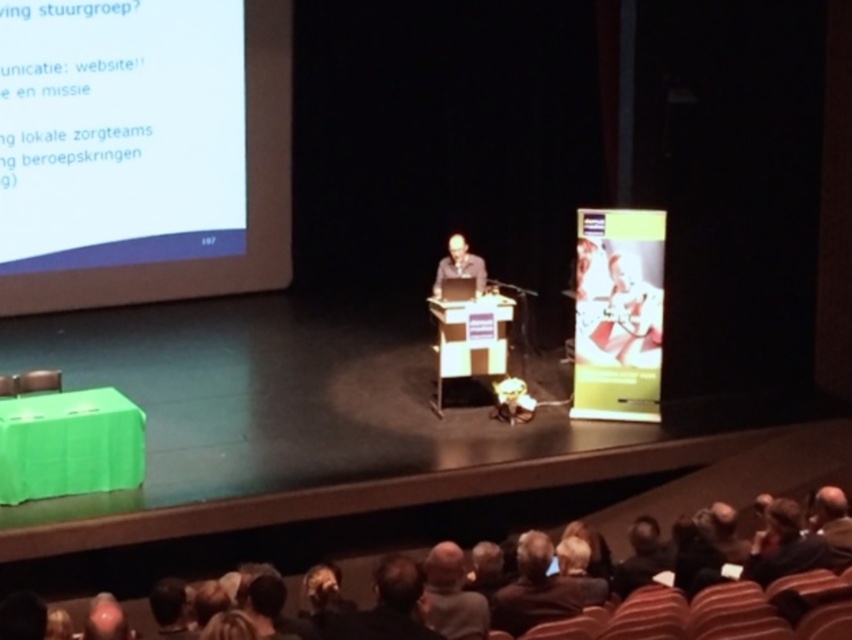
Question: Is brown leather jacket at center to the right of dark gray shirt at center from the viewer's perspective?

Choices:
 (A) no
 (B) yes

Answer: (B)

Question: Is brown leather jacket at lower center closer to the viewer compared to dark brown leather jacket at lower center?

Choices:
 (A) yes
 (B) no

Answer: (B)

Question: Which point is farther to the camera?

Choices:
 (A) (435, 611)
 (B) (839, 547)

Answer: (B)

Question: Which of the following is the farthest from the observer?

Choices:
 (A) (432, 624)
 (B) (453, 259)
 (C) (122, 67)

Answer: (C)

Question: Among these points, which one is nearest to the camera?

Choices:
 (A) (452, 268)
 (B) (498, 604)
 (C) (849, 552)

Answer: (B)

Question: Is white matte projector screen at upper left to the right of brown leather jacket at lower center from the viewer's perspective?

Choices:
 (A) yes
 (B) no

Answer: (B)